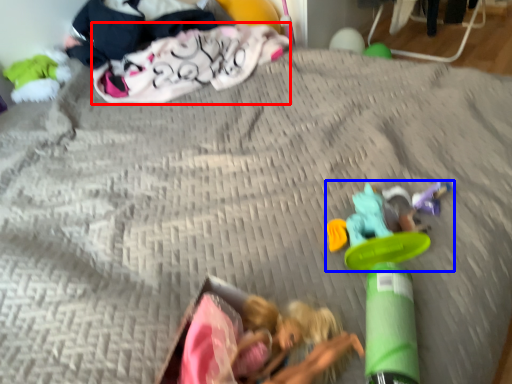
Question: Which point is closer to the camera, clothing (highlighted by a red box) or toy (highlighted by a blue box)?

Choices:
 (A) clothing
 (B) toy

Answer: (B)